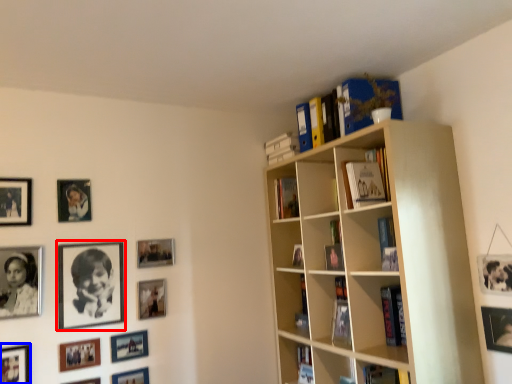
Question: Among these objects, which one is farthest to the camera, picture frame (highlighted by a red box) or picture frame (highlighted by a blue box)?

Choices:
 (A) picture frame
 (B) picture frame

Answer: (A)